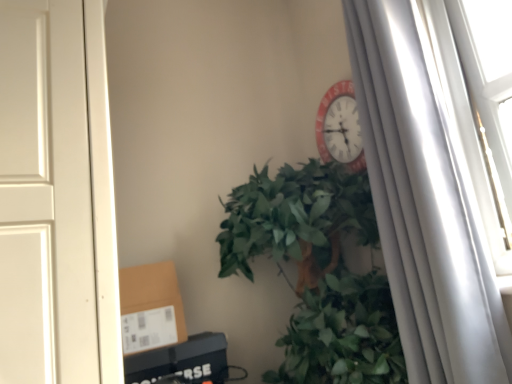
Image resolution: width=512 pixels, height=384 pixels. What do you see at coordinates (318, 272) in the screenshot?
I see `green leafy plant at center` at bounding box center [318, 272].

You are a GUI agent. You are given a task and a screenshot of the screen. Output one action in this format:
    pyautogui.click(x=<x>, y=<y>)
    Task: Click on the white matte curtain at right
    
    Given the screenshot: What is the action you would take?
    pyautogui.click(x=424, y=204)

Which of these two, brown cardboard box at lower left or green leafy plant at center, is smaller?

With smaller size is brown cardboard box at lower left.

From a real-world perspective, who is located higher, brown cardboard box at lower left or green leafy plant at center?

green leafy plant at center is physically above.

Is brown cardboard box at lower left far from green leafy plant at center?

brown cardboard box at lower left is actually quite close to green leafy plant at center.

From the image's perspective, who appears lower, brown cardboard box at lower left or green leafy plant at center?

brown cardboard box at lower left is shown below in the image.

Can you confirm if green leafy plant at center is shorter than brown cardboard box at lower left?

In fact, green leafy plant at center may be taller than brown cardboard box at lower left.

Locate an element on the screen. The image size is (512, 384). cardboard box on the left side of green leafy plant at center is located at coordinates (150, 307).

Does green leafy plant at center have a lesser width compared to brown cardboard box at lower left?

No.

Is the depth of green leafy plant at center greater than that of brown cardboard box at lower left?

No, the depth of green leafy plant at center is less than that of brown cardboard box at lower left.

Is brown cardboard box at lower left oriented away from white matte curtain at right?

brown cardboard box at lower left does not have its back to white matte curtain at right.

Between brown cardboard box at lower left and white matte curtain at right, which one has larger size?

white matte curtain at right is bigger.

Looking at this image, can we say brown cardboard box at lower left lies outside white matte curtain at right?

Yes, brown cardboard box at lower left is located beyond the bounds of white matte curtain at right.

Between brown cardboard box at lower left and white matte curtain at right, which one appears on the right side from the viewer's perspective?

white matte curtain at right.

Looking at their sizes, would you say green leafy plant at center is wider or thinner than white matte curtain at right?

In the image, green leafy plant at center appears to be wider than white matte curtain at right.

Looking at this image, which is closer, (351, 349) or (438, 288)?

Point (438, 288)

Can you see green leafy plant at center touching white matte curtain at right?

No.

Can you tell me how much green leafy plant at center and white matte curtain at right differ in facing direction?

The angle between the facing direction of green leafy plant at center and the facing direction of white matte curtain at right is 79.4 degrees.

Which of these two, white matte curtain at right or brown cardboard box at lower left, is smaller?

With smaller size is brown cardboard box at lower left.

Find the location of a particular element. The height and width of the screenshot is (384, 512). cardboard box located behind the white matte curtain at right is located at coordinates (150, 307).

Which is closer to the camera, (436,288) or (168,268)?

Clearly, point (436,288) is closer to the camera than point (168,268).

From the image's perspective, is white matte curtain at right located above brown cardboard box at lower left?

Yes, from the image's perspective, white matte curtain at right is over brown cardboard box at lower left.

Is white matte curtain at right smaller than green leafy plant at center?

Yes.

The image size is (512, 384). Identify the location of houseplant below the white matte curtain at right (from a real-world perspective). (318, 272).

From the image's perspective, which is below, white matte curtain at right or green leafy plant at center?

From the image's view, green leafy plant at center is below.

Identify the location of houseplant that is on the right side of brown cardboard box at lower left. (318, 272).

In the image, there is a green leafy plant at center. Where is `cardboard box below it (from the image's perspective)`? cardboard box below it (from the image's perspective) is located at coordinates (x=150, y=307).

Based on their spatial positions, is brown cardboard box at lower left or white matte curtain at right further from green leafy plant at center?

brown cardboard box at lower left lies further to green leafy plant at center than the other object.

Considering their positions, is brown cardboard box at lower left positioned closer to white matte curtain at right than green leafy plant at center?

Among the two, green leafy plant at center is located nearer to white matte curtain at right.

Looking at the image, which one is located closer to brown cardboard box at lower left, white matte curtain at right or green leafy plant at center?

green leafy plant at center.

Based on the photo, considering their positions, is white matte curtain at right positioned closer to green leafy plant at center than brown cardboard box at lower left?

Based on the image, white matte curtain at right appears to be nearer to green leafy plant at center.

Looking at this image, looking at the image, which one is located closer to brown cardboard box at lower left, green leafy plant at center or white matte curtain at right?

green leafy plant at center.

Looking at this image, when comparing their distances from white matte curtain at right, does green leafy plant at center or brown cardboard box at lower left seem closer?

green leafy plant at center.

Where is `houseplant situated between brown cardboard box at lower left and white matte curtain at right from left to right`? houseplant situated between brown cardboard box at lower left and white matte curtain at right from left to right is located at coordinates (318, 272).